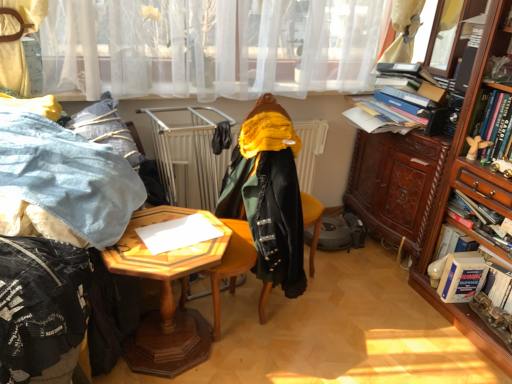
The image size is (512, 384). Find the location of `free point in front of velvet black coat at center`. free point in front of velvet black coat at center is located at coordinates pos(247,363).